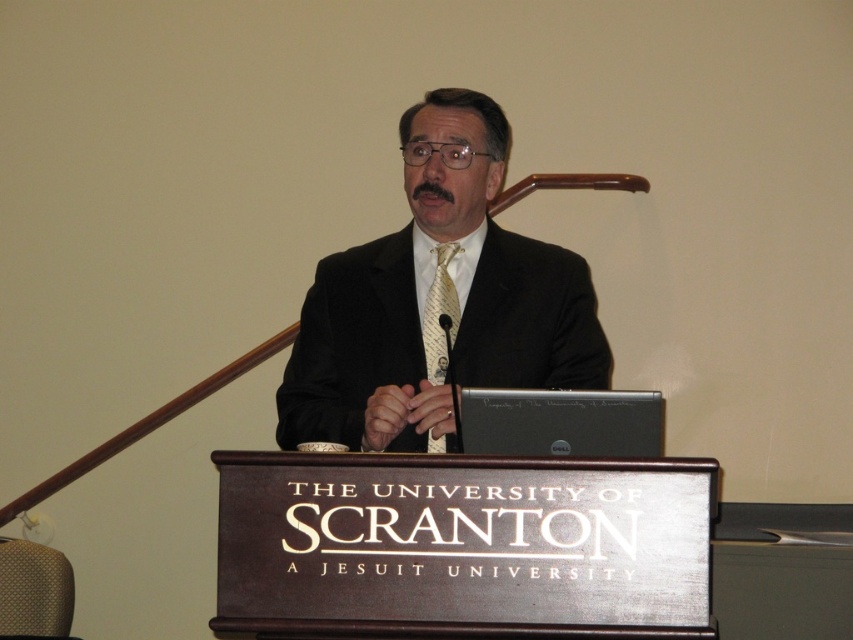
Question: Is black silk suit at center below black matte laptop at center?

Choices:
 (A) no
 (B) yes

Answer: (A)

Question: Does black silk suit at center have a lesser width compared to black matte laptop at center?

Choices:
 (A) yes
 (B) no

Answer: (B)

Question: Which of the following is the farthest from the observer?

Choices:
 (A) yellow silk tie at center
 (B) black matte laptop at center
 (C) black silk suit at center

Answer: (C)

Question: Which point is closer to the camera?

Choices:
 (A) yellow silk tie at center
 (B) black matte laptop at center
 (C) black silk suit at center

Answer: (B)

Question: Can you confirm if black matte laptop at center is positioned above yellow silk tie at center?

Choices:
 (A) no
 (B) yes

Answer: (A)

Question: Estimate the real-world distances between objects in this image. Which object is closer to the black matte laptop at center?

Choices:
 (A) yellow silk tie at center
 (B) black silk suit at center

Answer: (A)